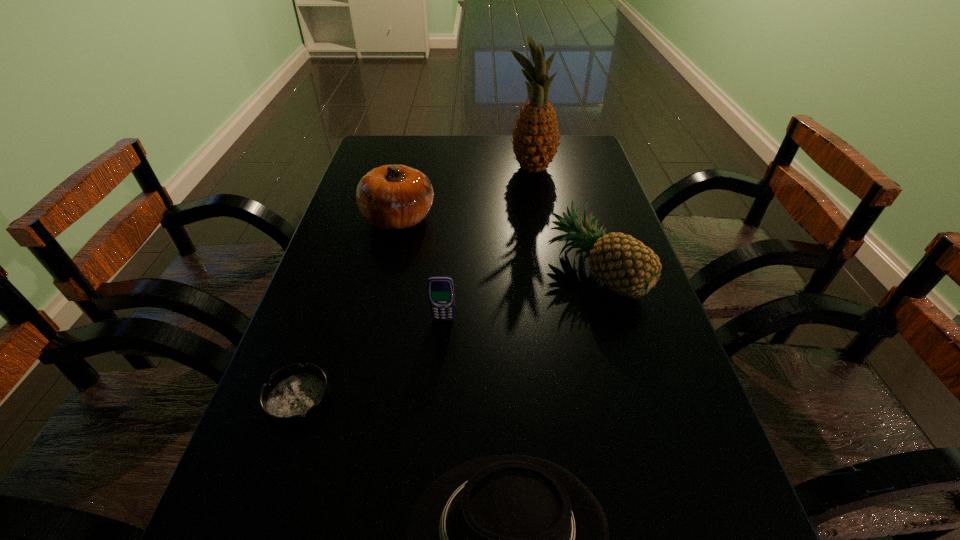
You are a GUI agent. You are given a task and a screenshot of the screen. Output one action in this format:
    pyautogui.click(x=<x>, y=<y>)
    Task: Click on the vacant space at the far right corner
    This screenshot has height=540, width=960.
    Given the screenshot: What is the action you would take?
    pyautogui.click(x=571, y=149)

At what (x,y) coordinates should I click in order to perform the action: click on vacant area that lies between the cellular telephone and the nearer pineapple. Please return your answer as a coordinate pair (x, y). The height and width of the screenshot is (540, 960). Looking at the image, I should click on (518, 296).

Where is `free area in between the shorter pineapple and the fourth farthest object`? free area in between the shorter pineapple and the fourth farthest object is located at coordinates (518, 296).

I want to click on unoccupied area between the pumpkin and the fourth farthest object, so click(420, 269).

Identify the location of free space between the second nearest object and the farther pineapple. This screenshot has width=960, height=540. (415, 284).

Identify which object is the fifth nearest to the taller pineapple. Please provide its 2D coordinates. Your answer should be formatted as a tuple, i.e. [(x, y)], where the tuple contains the x and y coordinates of a point satisfying the conditions above.

[(505, 539)]

Locate which object ranks second in proximity to the pumpkin. Please provide its 2D coordinates. Your answer should be formatted as a tuple, i.e. [(x, y)], where the tuple contains the x and y coordinates of a point satisfying the conditions above.

[(440, 288)]

The width and height of the screenshot is (960, 540). I want to click on blank area in the image that satisfies the following two spatial constraints: 1. on the back side of the shortest object; 2. on the left side of the tallest object, so click(x=376, y=168).

Find the location of a particular element. This screenshot has width=960, height=540. vacant point that satisfies the following two spatial constraints: 1. on the front side of the pumpkin; 2. on the right side of the nearer pineapple is located at coordinates (386, 272).

The width and height of the screenshot is (960, 540). In order to click on free spot that satisfies the following two spatial constraints: 1. on the front side of the shorter pineapple; 2. on the right side of the pumpkin in this screenshot , I will do `click(386, 272)`.